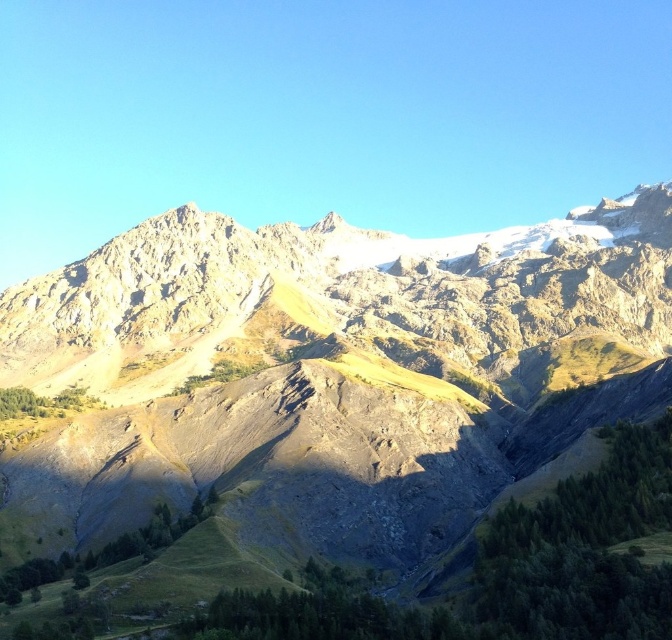
Question: Which object appears farthest from the camera in this image?

Choices:
 (A) rugged stone mountain at center
 (B) rugged stone mountain range at upper center

Answer: (B)

Question: Does rugged stone mountain at center appear on the right side of rugged stone mountain range at upper center?

Choices:
 (A) no
 (B) yes

Answer: (A)

Question: Which point is closer to the camera taking this photo?

Choices:
 (A) (374, 284)
 (B) (335, 371)

Answer: (B)

Question: Is rugged stone mountain at center smaller than rugged stone mountain range at upper center?

Choices:
 (A) no
 (B) yes

Answer: (A)

Question: Is rugged stone mountain at center closer to camera compared to rugged stone mountain range at upper center?

Choices:
 (A) yes
 (B) no

Answer: (A)